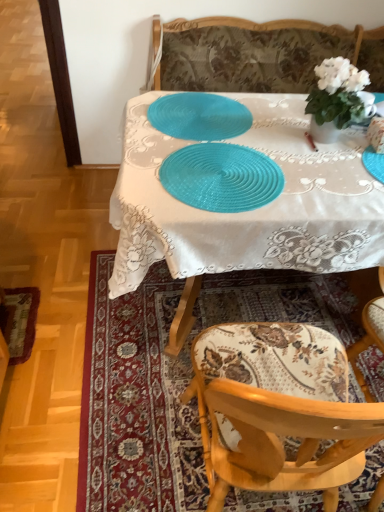
Locate an element on the screen. This screenshot has height=512, width=384. free spot above teal woven placemat at center, acting as the first tableware starting from the bottom (from a real-world perspective) is located at coordinates (221, 170).